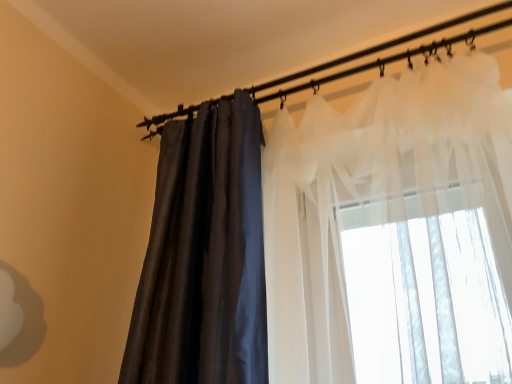
Measure the distance between translucent fabric at upper center and camera.

They are 36.93 inches apart.

What do you see at coordinates (385, 57) in the screenshot?
I see `translucent fabric at upper center` at bounding box center [385, 57].

Locate an element on the screen. The width and height of the screenshot is (512, 384). translucent fabric at upper center is located at coordinates (385, 57).

In order to click on translucent fabric at upper center in this screenshot , I will do `click(385, 57)`.